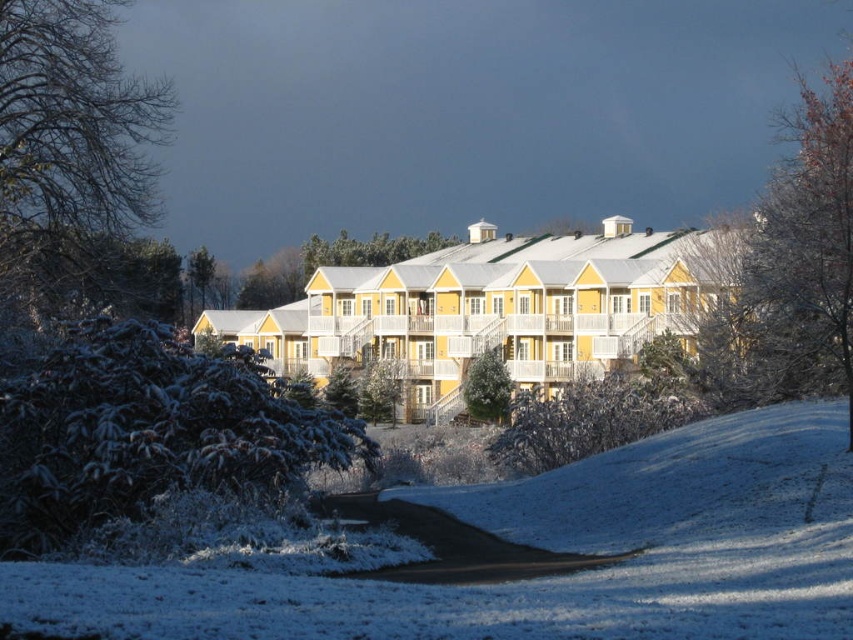
Is point (202, 464) closer to camera compared to point (106, 252)?

Yes, point (202, 464) is in front of point (106, 252).

Who is more distant from viewer, (199, 456) or (61, 48)?

The point (61, 48) is more distant.

The width and height of the screenshot is (853, 640). I want to click on frosted pine tree at lower left, so click(x=148, y=432).

Does point (775, 307) come farther from viewer compared to point (476, 404)?

No.

Find the location of a particular element. The width and height of the screenshot is (853, 640). bare branches at upper right is located at coordinates (790, 266).

Can you confirm if frosted pine tree at lower left is positioned to the right of bare branches at upper right?

No, frosted pine tree at lower left is not to the right of bare branches at upper right.

Who is shorter, frosted pine tree at lower left or bare branches at upper right?

frosted pine tree at lower left

Is point (154, 470) closer to camera compared to point (795, 224)?

That is True.

Find the location of a particular element. The width and height of the screenshot is (853, 640). frosted pine tree at lower left is located at coordinates (148, 432).